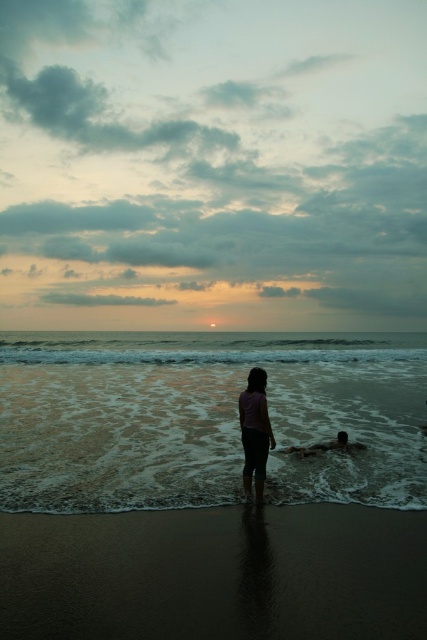
Does point (91, 634) lie behind point (339, 444)?

No, (91, 634) is closer to viewer.

Which is behind, point (335, 532) or point (342, 442)?

Point (342, 442)

Where is `dark brown sand at lower center`? The height and width of the screenshot is (640, 427). dark brown sand at lower center is located at coordinates (215, 573).

Can you confirm if dark brown sand at lower center is positioned to the right of pink fabric at center?

Incorrect, dark brown sand at lower center is not on the right side of pink fabric at center.

Looking at this image, can you confirm if dark brown sand at lower center is smaller than pink fabric at center?

Yes, dark brown sand at lower center is smaller than pink fabric at center.

Who is more forward, (149, 625) or (265, 451)?

Point (149, 625) is in front.

Image resolution: width=427 pixels, height=640 pixels. I want to click on dark brown sand at lower center, so click(x=215, y=573).

Which of these two, pink fabric at center or smooth skin person at lower center, stands taller?

With more height is pink fabric at center.

This screenshot has width=427, height=640. Identify the location of pink fabric at center. (254, 432).

Identify the location of pink fabric at center. (254, 432).